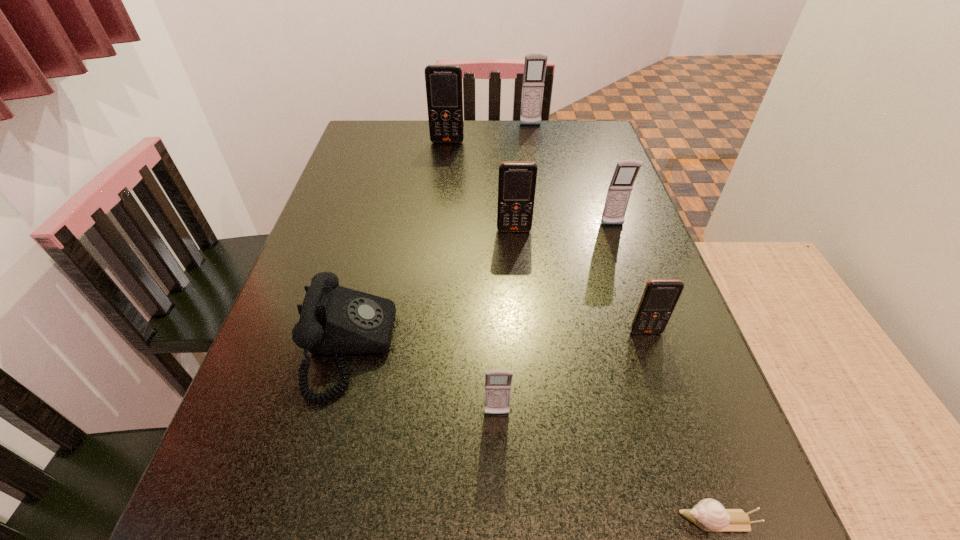
The height and width of the screenshot is (540, 960). I want to click on vacant position located on the screen of the rightmost orange cellular telephone, so (x=655, y=357).

At what (x,y) coordinates should I click in order to perform the action: click on vacant space located 0.130m on the front-facing side of the smallest gray cellular telephone. Please return your answer as a coordinate pair (x, y). Looking at the image, I should click on (499, 508).

In order to click on blank area located on the dial of the telephone in this screenshot , I will do `click(518, 347)`.

I want to click on vacant space located 0.110m on the shell of the shortest object, so click(x=600, y=521).

Identify the location of free space located 0.100m on the shell of the shortest object. (607, 521).

Identify the location of vacant space situated on the shell of the shortest object. The width and height of the screenshot is (960, 540). (614, 521).

Where is `object positioned at the near edge`? The height and width of the screenshot is (540, 960). object positioned at the near edge is located at coordinates (709, 515).

What are the coordinates of `object that is at the left edge` in the screenshot? It's located at (334, 320).

Locate an element on the screen. The image size is (960, 540). escargot that is at the right edge is located at coordinates (709, 515).

Locate an element on the screen. The width and height of the screenshot is (960, 540). object that is at the near right corner is located at coordinates (709, 515).